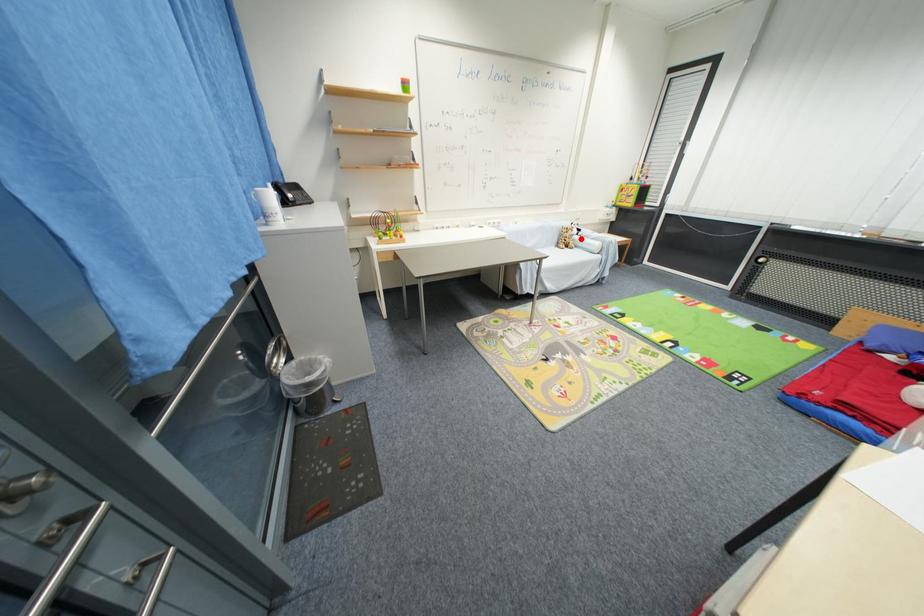
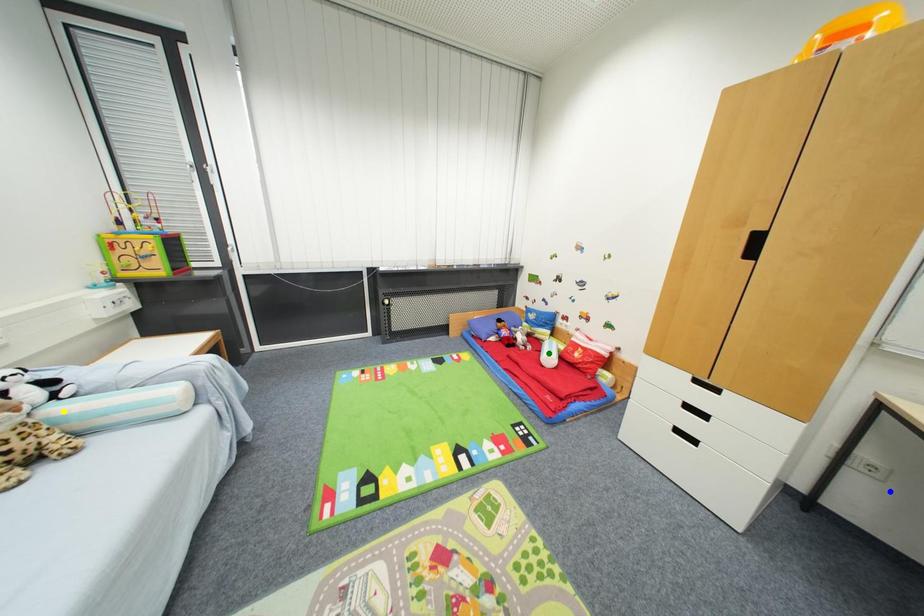
Question: I am providing you with two images of the same scene from different viewpoints. A red point is marked on the first image. You are given multiple points on the second image. Which point in image 2 is actually the same real-world point as the red point in image 1?

Choices:
 (A) yellow point
 (B) green point
 (C) blue point

Answer: (A)